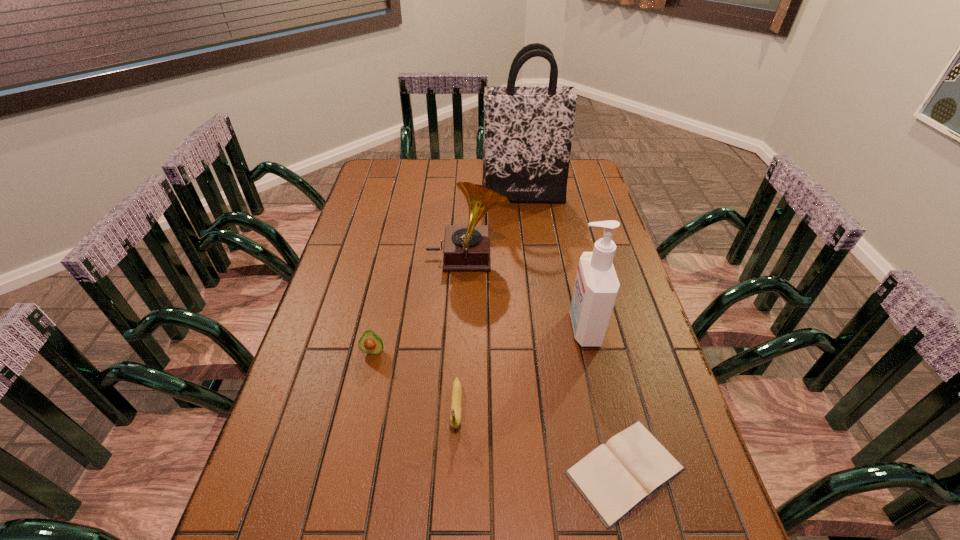
Where is `the tallest object`? the tallest object is located at coordinates (528, 130).

The image size is (960, 540). Find the location of `shopping bag`. shopping bag is located at coordinates (528, 130).

Identify the location of the second tallest object. (596, 287).

Identify the location of phonograph record. The image size is (960, 540). (466, 247).

The image size is (960, 540). In order to click on the fifth nearest object in this screenshot , I will do `click(466, 247)`.

Find the location of a particular element. Image resolution: width=960 pixels, height=540 pixels. avocado is located at coordinates (371, 343).

Image resolution: width=960 pixels, height=540 pixels. Find the location of `banana`. banana is located at coordinates (456, 396).

Where is `the shortest object`? Image resolution: width=960 pixels, height=540 pixels. the shortest object is located at coordinates (616, 477).

Where is `free space located on the front of the tallest object with the design`? free space located on the front of the tallest object with the design is located at coordinates (528, 235).

Where is `vacant space located on the front label of the fifth shortest object`? This screenshot has height=540, width=960. vacant space located on the front label of the fifth shortest object is located at coordinates (480, 328).